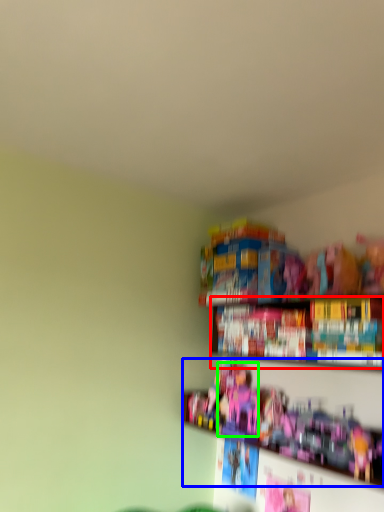
Question: Which object is positioned closest to book (highlighted by a red box)? Select from toy (highlighted by a blue box) and toy (highlighted by a green box).

Choices:
 (A) toy
 (B) toy

Answer: (A)